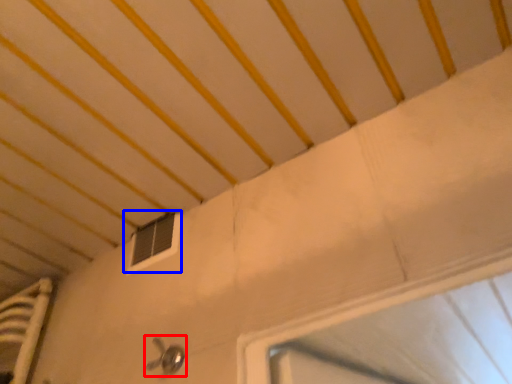
Question: Which object appears farthest to the camera in this image, door handle (highlighted by a red box) or window (highlighted by a blue box)?

Choices:
 (A) door handle
 (B) window

Answer: (B)